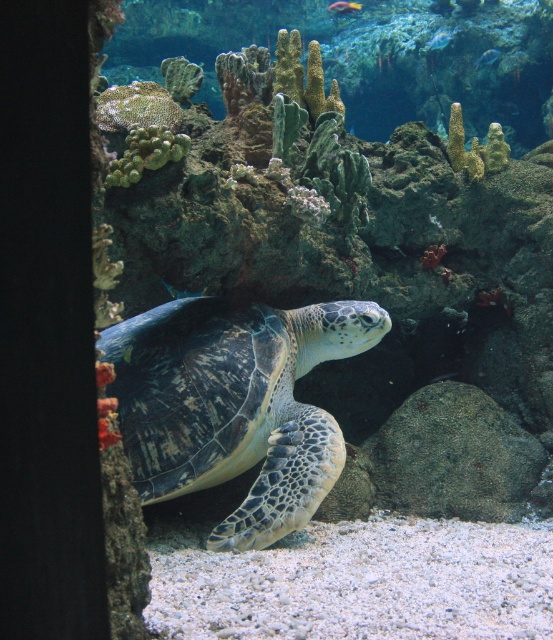
Question: Which point appears closest to the camera in this image?

Choices:
 (A) (427, 51)
 (B) (491, 49)
 (C) (340, 12)
 (D) (291, 516)

Answer: (D)

Question: Is the position of leathery green turtle at center more distant than that of shiny blue fish at upper center?

Choices:
 (A) yes
 (B) no

Answer: (B)

Question: Which point is closer to the camera?

Choices:
 (A) leathery green turtle at center
 (B) shiny blue fish at upper center
 (C) gray rough rock at center-right

Answer: (A)

Question: Which point is closer to the camera taking this photo?

Choices:
 (A) (374, 337)
 (B) (493, 61)
 (C) (346, 12)

Answer: (A)

Question: From the image, what is the correct spatial relationship of translucent blue fish at upper center in relation to shiny blue fish at upper center?

Choices:
 (A) left
 (B) right

Answer: (A)

Question: Is the position of gray rough rock at center-right less distant than that of translucent blue fish at upper center?

Choices:
 (A) yes
 (B) no

Answer: (A)